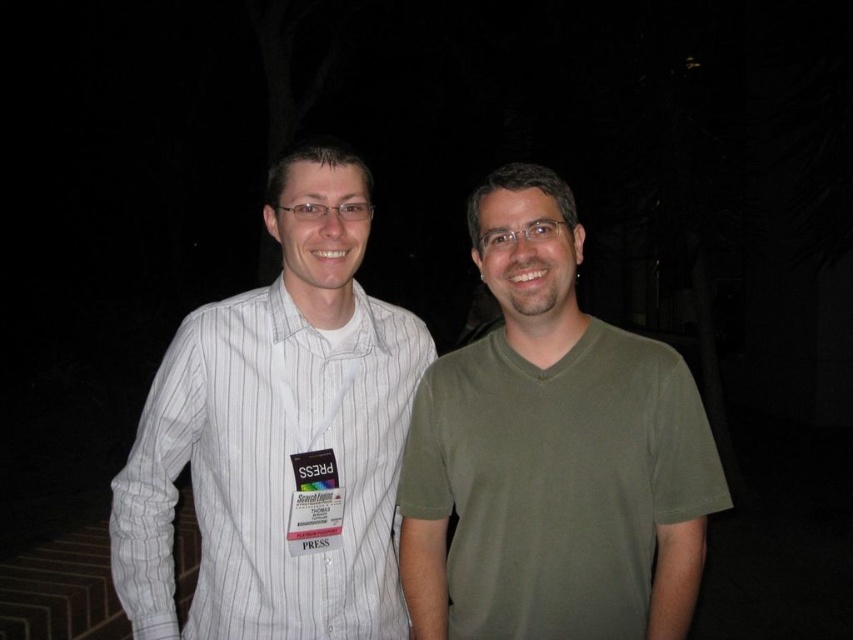
Can you confirm if green matte t-shirt at center is wider than white striped shirt at left?

No, green matte t-shirt at center is not wider than white striped shirt at left.

Can you confirm if green matte t-shirt at center is positioned to the right of white striped shirt at left?

Indeed, green matte t-shirt at center is positioned on the right side of white striped shirt at left.

Between point (664, 593) and point (265, 579), which one is positioned behind?

The point (265, 579) is more distant.

You are a GUI agent. You are given a task and a screenshot of the screen. Output one action in this format:
    pyautogui.click(x=<x>, y=<y>)
    Task: Click on the green matte t-shirt at center
    
    Given the screenshot: What is the action you would take?
    pyautogui.click(x=552, y=452)